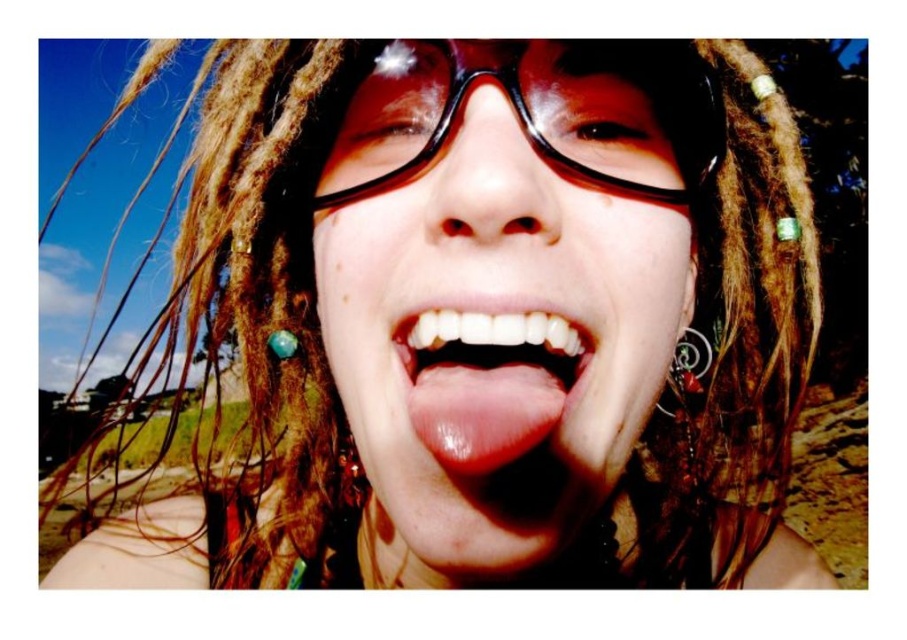
Does satin black glasses at center have a lesser height compared to transparent plastic glasses at center?

No, satin black glasses at center is not shorter than transparent plastic glasses at center.

This screenshot has height=640, width=907. What do you see at coordinates (496, 296) in the screenshot? I see `satin black glasses at center` at bounding box center [496, 296].

What do you see at coordinates (496, 296) in the screenshot? This screenshot has height=640, width=907. I see `satin black glasses at center` at bounding box center [496, 296].

Where is `satin black glasses at center`? The height and width of the screenshot is (640, 907). satin black glasses at center is located at coordinates (496, 296).

Can you confirm if satin black glasses at center is taller than shiny white teeth at center?

Yes.

Who is positioned more to the left, satin black glasses at center or shiny white teeth at center?

shiny white teeth at center is more to the left.

Is point (428, 88) positioned in front of point (445, 339)?

That is False.

This screenshot has height=640, width=907. In order to click on satin black glasses at center in this screenshot , I will do `click(496, 296)`.

Which of these two, shiny white teeth at center or transparent plastic glasses at center, stands shorter?

shiny white teeth at center is shorter.

Is point (473, 348) positioned after point (689, 106)?

No.

You are a GUI agent. You are given a task and a screenshot of the screen. Output one action in this format:
    pyautogui.click(x=<x>, y=<y>)
    Task: Click on the shiny white teeth at center
    
    Given the screenshot: What is the action you would take?
    pyautogui.click(x=486, y=381)